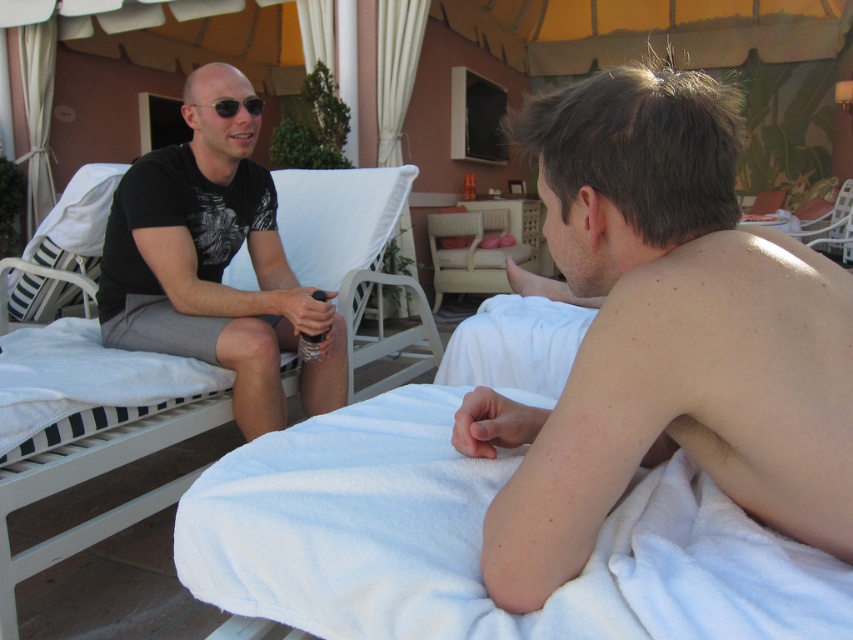
Question: Is white striped fabric beach chair at left in front of black matte sunglasses at left?

Choices:
 (A) no
 (B) yes

Answer: (A)

Question: Among these objects, which one is nearest to the camera?

Choices:
 (A) beige fabric beach chair at center
 (B) smooth skin torso at right
 (C) white striped fabric beach chair at left

Answer: (B)

Question: Which object is the farthest from the black matte sunglasses at left?

Choices:
 (A) white fabric beach chair at left
 (B) smooth skin torso at right
 (C) beige fabric beach chair at center

Answer: (C)

Question: Which is nearer to the white fabric beach chair at left?

Choices:
 (A) black matte t-shirt at left
 (B) black matte sunglasses at left
 (C) smooth skin torso at right

Answer: (A)

Question: Can you confirm if black matte t-shirt at left is positioned to the right of white striped fabric beach chair at left?

Choices:
 (A) yes
 (B) no

Answer: (A)

Question: Is black matte t-shirt at left positioned at the back of white striped fabric beach chair at left?

Choices:
 (A) no
 (B) yes

Answer: (A)